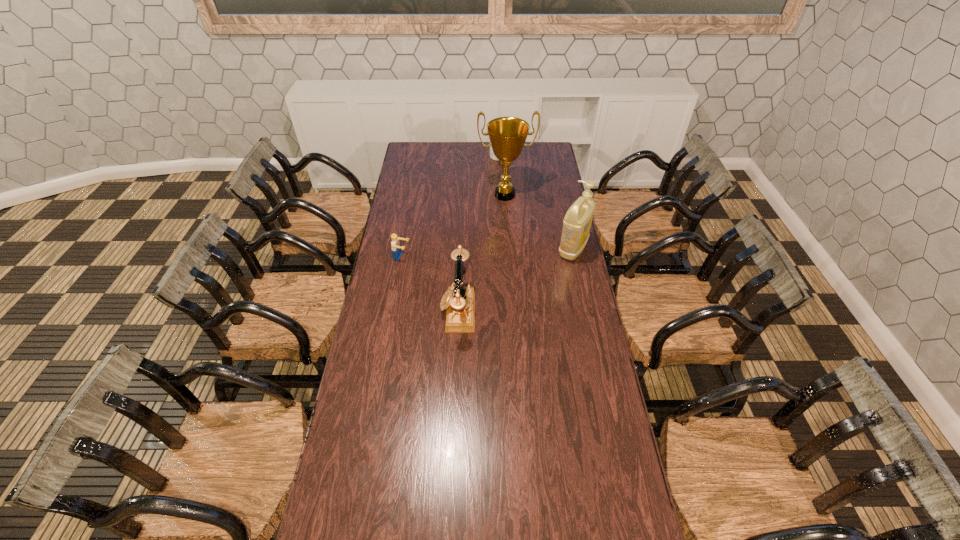
Where is `blank region between the second tallest object and the second object from left to right`? The width and height of the screenshot is (960, 540). blank region between the second tallest object and the second object from left to right is located at coordinates (516, 280).

You are a GUI agent. You are given a task and a screenshot of the screen. Output one action in this format:
    pyautogui.click(x=<x>, y=<y>)
    Task: Click on the empty space that is in between the telephone and the tallest object
    Image resolution: width=960 pixels, height=540 pixels.
    Given the screenshot: What is the action you would take?
    pyautogui.click(x=481, y=252)

Locate an element on the screen. free space between the cup and the third tallest object is located at coordinates (478, 234).

Where is `vacant point located between the telephone and the farthest object`? vacant point located between the telephone and the farthest object is located at coordinates (478, 234).

Find the location of a particular element. The width and height of the screenshot is (960, 540). free space between the fourth object from right to left and the fourth nearest object is located at coordinates (481, 252).

You are a GUI agent. You are given a task and a screenshot of the screen. Output one action in this format:
    pyautogui.click(x=<x>, y=<y>)
    Task: Click on the vacant space that is in between the telephone and the farthest object
    This screenshot has height=540, width=960.
    Given the screenshot: What is the action you would take?
    pyautogui.click(x=478, y=234)

The image size is (960, 540). What are the coordinates of `free area in between the award and the nearest object` in the screenshot? It's located at (481, 252).

The height and width of the screenshot is (540, 960). Identify the location of free space between the second tallest object and the third tallest object. (516, 280).

Identify the location of object that is the second closest to the award. Image resolution: width=960 pixels, height=540 pixels. (577, 222).

Select which object appears as the fourth closest to the nearest object. Please provide its 2D coordinates. Your answer should be formatted as a tuple, i.e. [(x, y)], where the tuple contains the x and y coordinates of a point satisfying the conditions above.

[(492, 156)]